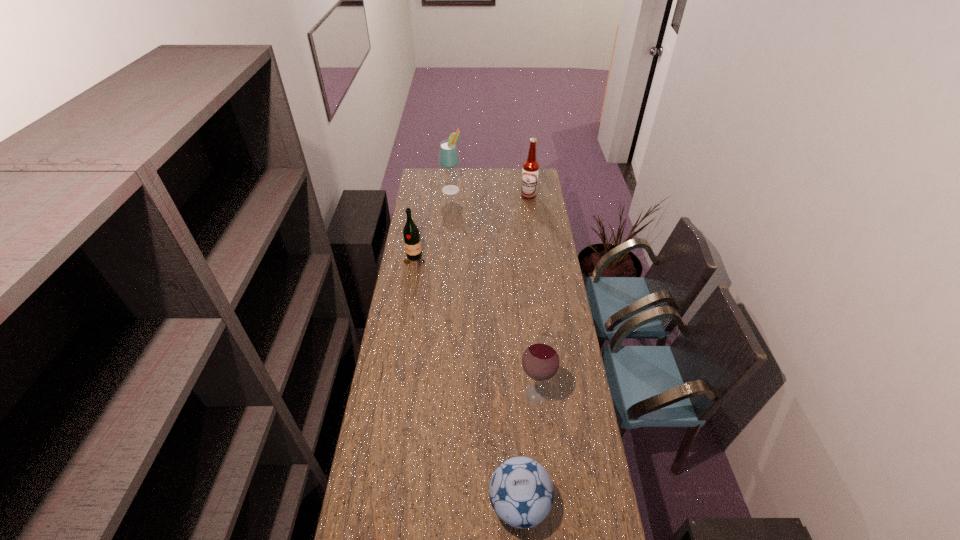
Where is `the leftmost alcohol`? the leftmost alcohol is located at coordinates (448, 158).

Locate an element on the screen. wine bottle is located at coordinates (411, 234).

Find the location of `the leftmost object`. the leftmost object is located at coordinates (411, 234).

Where is `the shortest alcohol`? The image size is (960, 540). the shortest alcohol is located at coordinates [x=540, y=361].

The height and width of the screenshot is (540, 960). What are the coordinates of `the fourth farthest object` in the screenshot? It's located at (540, 361).

This screenshot has height=540, width=960. In order to click on soccer ball in this screenshot , I will do `click(521, 492)`.

Where is `the shortest object`? the shortest object is located at coordinates (521, 492).

Identify the location of vacant space located on the back of the fourth object from right to left. (452, 173).

Image resolution: width=960 pixels, height=540 pixels. I want to click on free space located on the surface of the third farthest object, so click(x=408, y=303).

In order to click on vacant space located on the back of the nearest alcohol in this screenshot , I will do `click(527, 314)`.